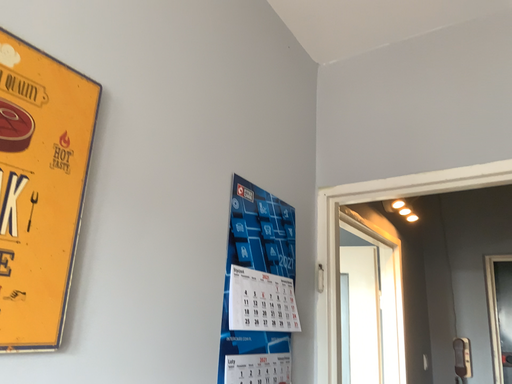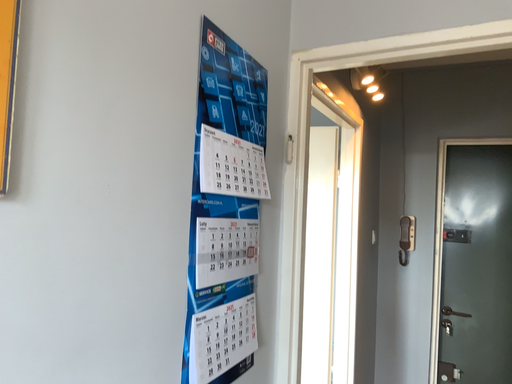
Question: How did the camera likely rotate when shooting the video?

Choices:
 (A) rotated downward
 (B) rotated upward

Answer: (A)